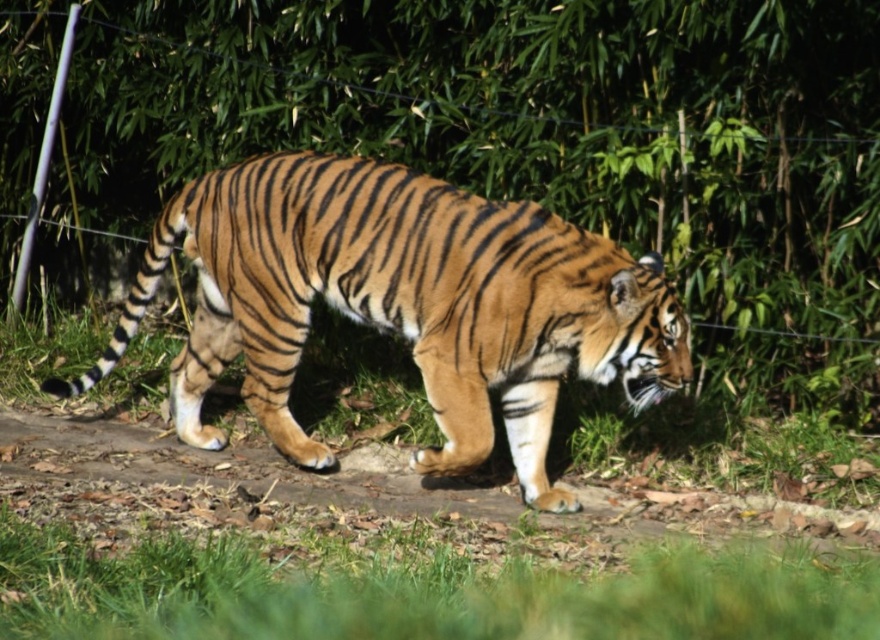
Question: Among these points, which one is farthest from the camera?

Choices:
 (A) [x=453, y=252]
 (B) [x=577, y=515]
 (C) [x=794, y=22]

Answer: (C)

Question: Is orange-brown fur tiger at center above brown dirt path at center?

Choices:
 (A) no
 (B) yes

Answer: (B)

Question: Estimate the real-world distances between objects in this image. Which object is farther from the brown dirt path at center?

Choices:
 (A) wire mesh at center
 (B) orange-brown fur tiger at center

Answer: (A)

Question: Which point is closer to the camera taking this photo?

Choices:
 (A) (394, 472)
 (B) (224, 225)
 (C) (88, 26)

Answer: (B)

Question: Does wire mesh at center have a greater width compared to orange-brown fur tiger at center?

Choices:
 (A) yes
 (B) no

Answer: (A)

Question: In this image, where is orange-brown fur tiger at center located relative to brown dirt path at center?

Choices:
 (A) above
 (B) below

Answer: (A)